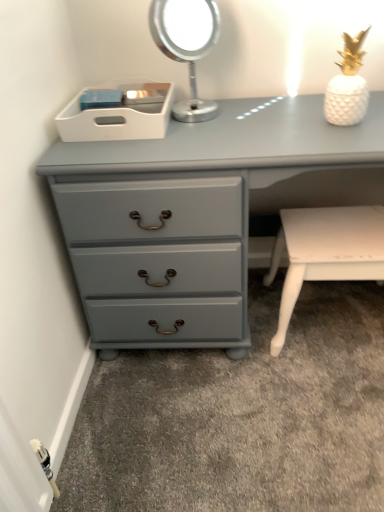
You are a GUI agent. You are given a task and a screenshot of the screen. Output one action in this format:
    pyautogui.click(x=<x>, y=<y>)
    Task: Click on the space that is in front of metallic silver mirror at upper center
    
    Given the screenshot: What is the action you would take?
    pyautogui.click(x=202, y=135)